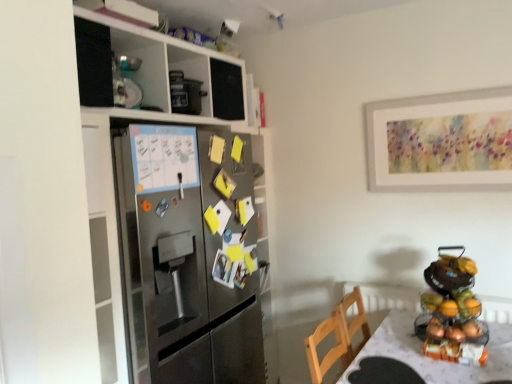
Question: From the image's perspective, is metallic fruit stand at right above or below stainless steel refrigerator at left?

Choices:
 (A) above
 (B) below

Answer: (B)

Question: From a real-world perspective, is metallic fruit stand at right above or below stainless steel refrigerator at left?

Choices:
 (A) below
 (B) above

Answer: (A)

Question: Considering the real-world distances, which object is closest to the shiny metallic fruit basket at right?

Choices:
 (A) white textured table at lower right
 (B) metallic fruit stand at right
 (C) stainless steel refrigerator at left

Answer: (B)

Question: Estimate the real-world distances between objects in this image. Which object is farther from the stainless steel refrigerator at left?

Choices:
 (A) white textured table at lower right
 (B) shiny metallic fruit basket at right
 (C) metallic fruit stand at right

Answer: (B)